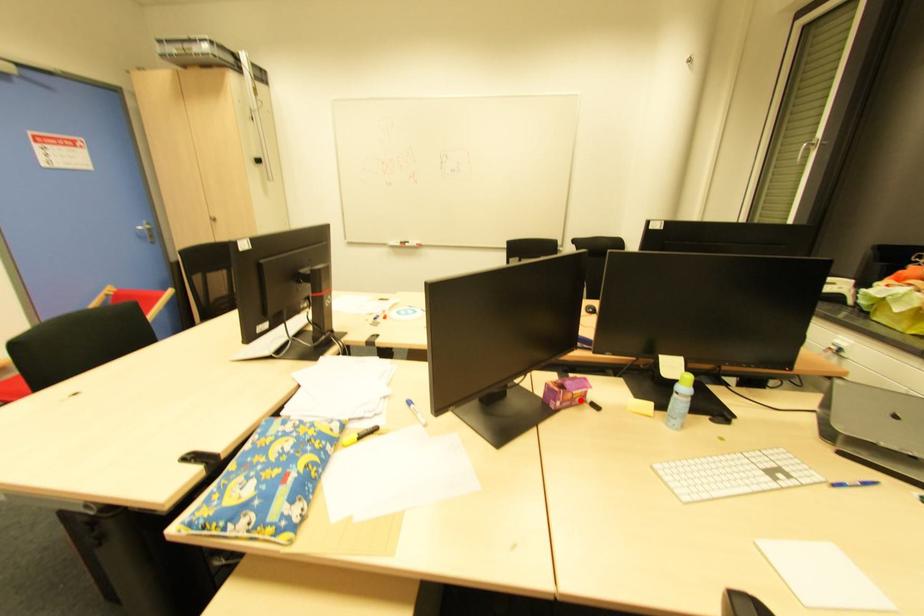
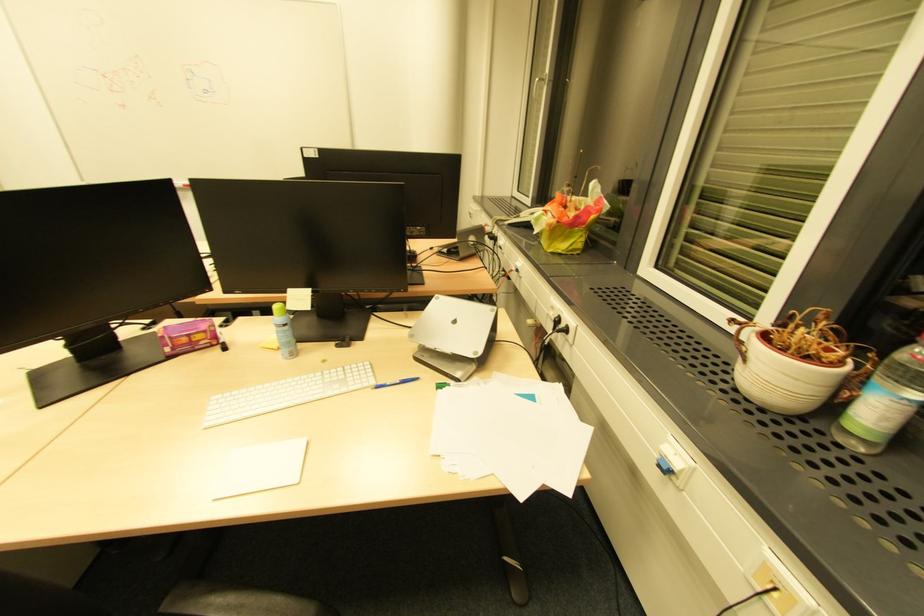
The point at the highlighted location is marked in the first image. Where is the corresponding point in the second image?

(209, 342)